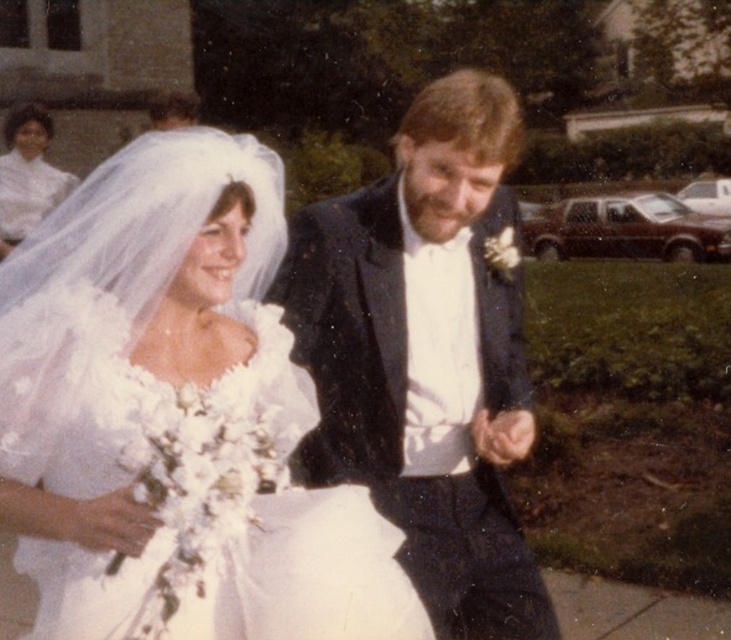
Question: Which point appears closest to the camera in this image?

Choices:
 (A) (395, 198)
 (B) (45, 186)
 (C) (115, 264)

Answer: (C)

Question: Is shiny black tuxedo at center to the left of white satin dress at upper left from the viewer's perspective?

Choices:
 (A) no
 (B) yes

Answer: (A)

Question: Is shiny black tuxedo at center above white satin dress at upper left?

Choices:
 (A) yes
 (B) no

Answer: (B)

Question: Which object appears farthest from the camera in this image?

Choices:
 (A) white satin dress at upper left
 (B) white satin dress at center
 (C) shiny black tuxedo at center

Answer: (A)

Question: Considering the relative positions of white satin dress at center and shiny black tuxedo at center in the image provided, where is white satin dress at center located with respect to shiny black tuxedo at center?

Choices:
 (A) left
 (B) right

Answer: (A)

Question: Which point is closer to the camera?

Choices:
 (A) (56, 170)
 (B) (541, 630)

Answer: (B)